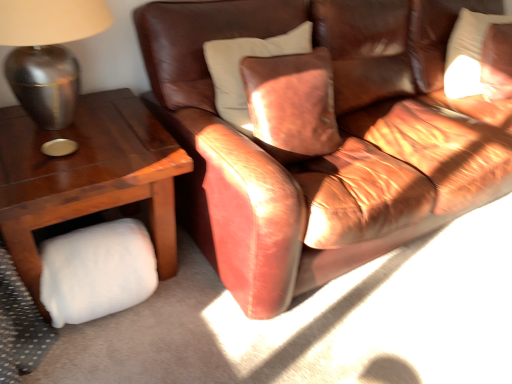
Question: Is white fluffy pillow at lower left shorter than white soft pillow at upper right?

Choices:
 (A) no
 (B) yes

Answer: (B)

Question: Is white soft pillow at upper right inside white fluffy pillow at lower left?

Choices:
 (A) yes
 (B) no

Answer: (B)

Question: Can you confirm if white fluffy pillow at lower left is smaller than white soft pillow at upper right?

Choices:
 (A) no
 (B) yes

Answer: (B)

Question: From a real-world perspective, is white fluffy pillow at lower left below white soft pillow at upper right?

Choices:
 (A) no
 (B) yes

Answer: (B)

Question: Is white fluffy pillow at lower left closer to the viewer compared to white soft pillow at upper right?

Choices:
 (A) no
 (B) yes

Answer: (B)

Question: Based on their positions, is white soft pillow at upper right located to the left or right of metallic silver lamp at left?

Choices:
 (A) left
 (B) right

Answer: (B)

Question: In terms of height, does white soft pillow at upper right look taller or shorter compared to metallic silver lamp at left?

Choices:
 (A) short
 (B) tall

Answer: (B)

Question: Which is correct: white soft pillow at upper right is inside metallic silver lamp at left, or outside of it?

Choices:
 (A) outside
 (B) inside

Answer: (A)

Question: In terms of width, does white soft pillow at upper right look wider or thinner when compared to metallic silver lamp at left?

Choices:
 (A) wide
 (B) thin

Answer: (B)

Question: From the image's perspective, is leather couch at center above or below metallic silver lamp at left?

Choices:
 (A) below
 (B) above

Answer: (B)

Question: Considering the relative positions of leather couch at center and metallic silver lamp at left in the image provided, is leather couch at center to the left or to the right of metallic silver lamp at left?

Choices:
 (A) right
 (B) left

Answer: (A)

Question: Looking at their shapes, would you say leather couch at center is wider or thinner than metallic silver lamp at left?

Choices:
 (A) wide
 (B) thin

Answer: (A)

Question: Is leather couch at center spatially inside metallic silver lamp at left, or outside of it?

Choices:
 (A) outside
 (B) inside

Answer: (A)

Question: From the image's perspective, is white fluffy pillow at lower left located above or below metallic silver lamp at left?

Choices:
 (A) above
 (B) below

Answer: (B)

Question: Is white fluffy pillow at lower left situated inside metallic silver lamp at left or outside?

Choices:
 (A) outside
 (B) inside

Answer: (A)